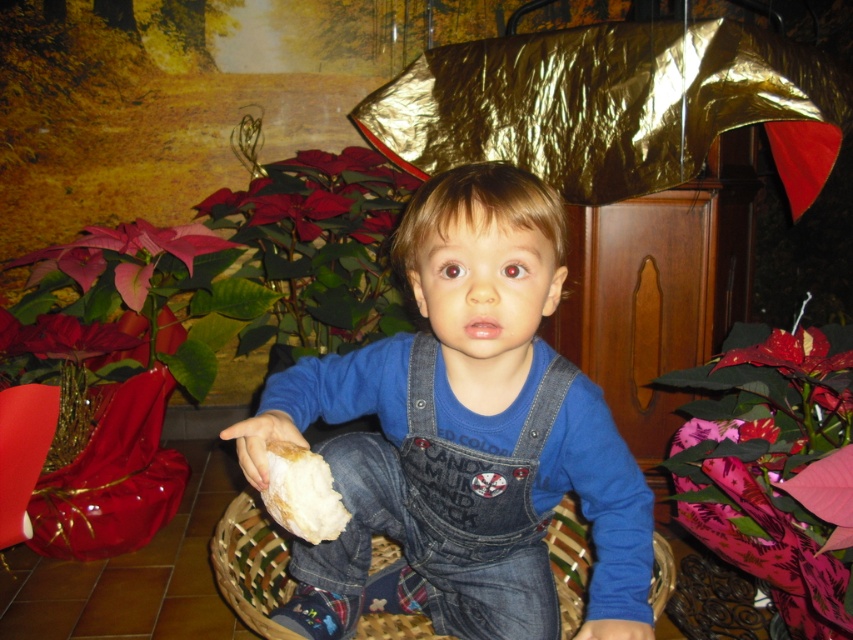
Question: Which point is farther from the camera taking this photo?

Choices:
 (A) (434, 244)
 (B) (277, 499)
 (C) (403, 628)

Answer: (C)

Question: From the image, what is the correct spatial relationship of denim overalls at center in relation to white crumbly bread at center?

Choices:
 (A) right
 (B) left

Answer: (A)

Question: Can you confirm if denim overalls at center is positioned below white crumbly bread at center?

Choices:
 (A) no
 (B) yes

Answer: (B)

Question: Can you confirm if denim overalls at center is positioned above white crumbly bread at center?

Choices:
 (A) no
 (B) yes

Answer: (A)

Question: Which point is closer to the camera?

Choices:
 (A) denim overalls at center
 (B) woven wood basket at center
 (C) white crumbly bread at center

Answer: (C)

Question: Which object appears farthest from the camera in this image?

Choices:
 (A) woven wood basket at center
 (B) white crumbly bread at center
 (C) denim overalls at center

Answer: (A)